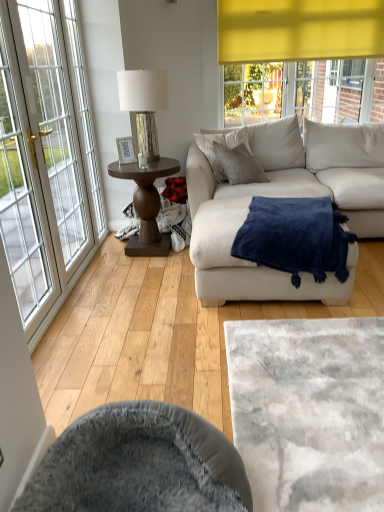
Find the location of `vacant location below velvety gray cat bed at lower center (from a real-world perspective)`. vacant location below velvety gray cat bed at lower center (from a real-world perspective) is located at coordinates tap(311, 416).